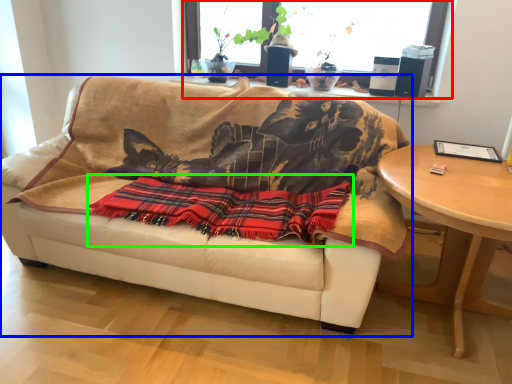
Question: Which object is the farthest from window (highlighted by a red box)? Choose among these: studio couch (highlighted by a blue box) or blanket (highlighted by a green box).

Choices:
 (A) studio couch
 (B) blanket

Answer: (B)